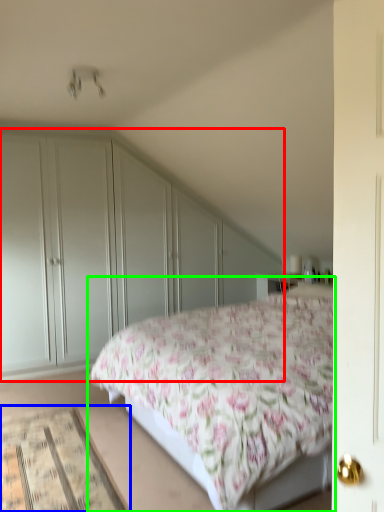
Question: Which is nearer to the dresser (highlighted by a red box)? mat (highlighted by a blue box) or bed (highlighted by a green box).

Choices:
 (A) mat
 (B) bed

Answer: (B)